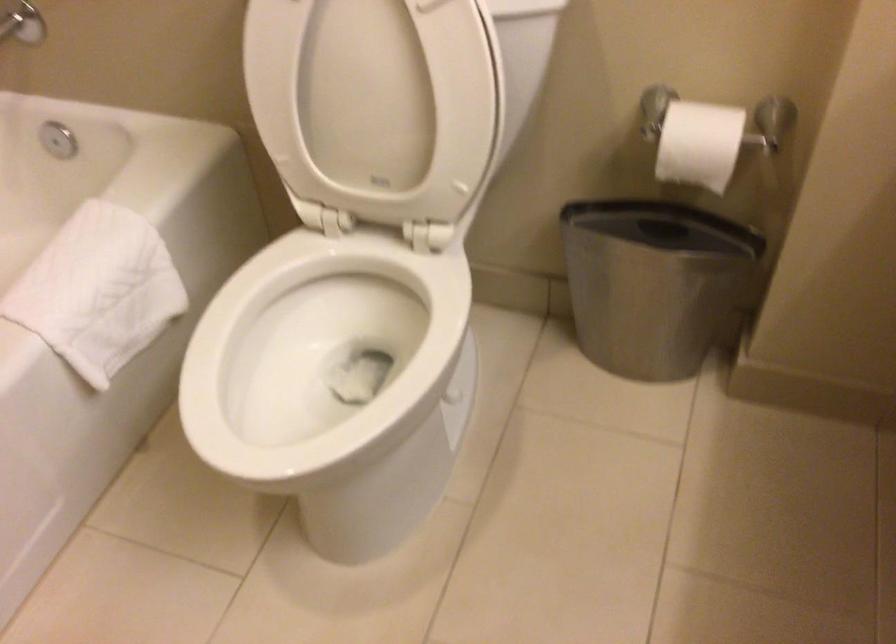
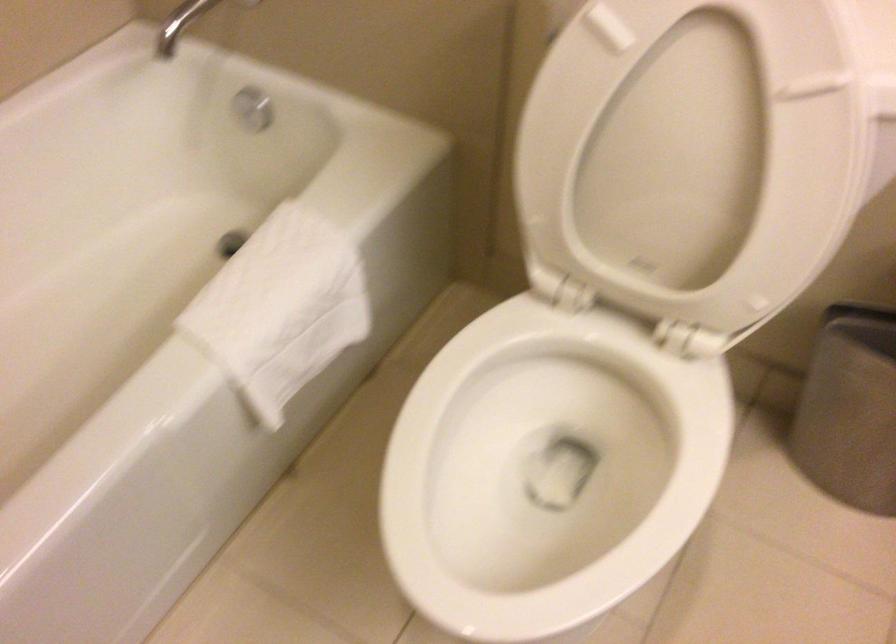
Find the pixel in the second image that matches point (604, 281) in the first image.

(858, 402)